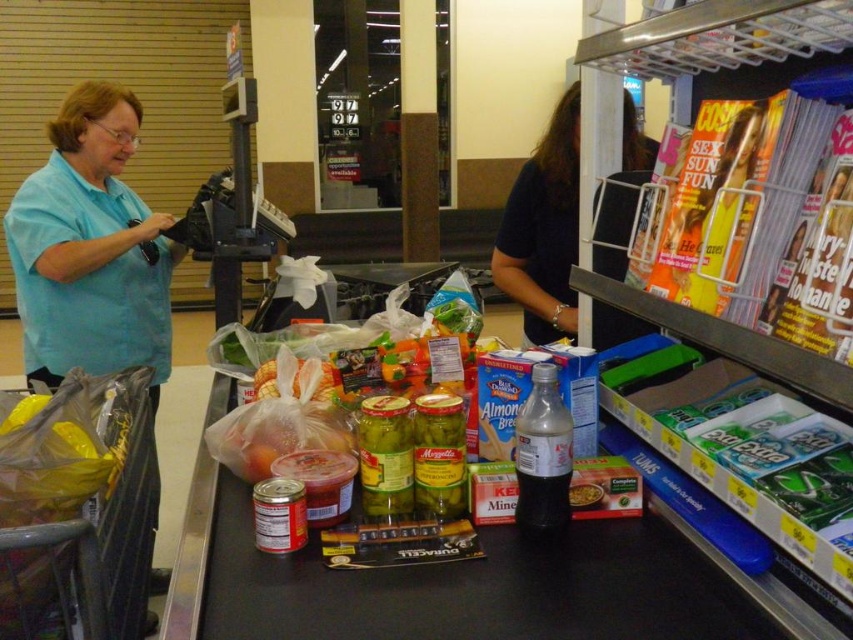
Question: Considering the real-world distances, which object is farthest from the light blue shirt at left?

Choices:
 (A) dark blue shirt at center
 (B) smooth plastic container at center

Answer: (B)

Question: Which of the following is the farthest from the observer?

Choices:
 (A) smooth plastic container at center
 (B) light blue shirt at left
 (C) dark blue shirt at center

Answer: (B)

Question: Is light blue shirt at left above smooth plastic container at center?

Choices:
 (A) yes
 (B) no

Answer: (A)

Question: Is light blue shirt at left bigger than smooth plastic container at center?

Choices:
 (A) no
 (B) yes

Answer: (B)

Question: Which object is farther from the camera taking this photo?

Choices:
 (A) light blue shirt at left
 (B) dark blue shirt at center

Answer: (A)

Question: Is light blue shirt at left closer to the viewer compared to smooth plastic container at center?

Choices:
 (A) yes
 (B) no

Answer: (B)